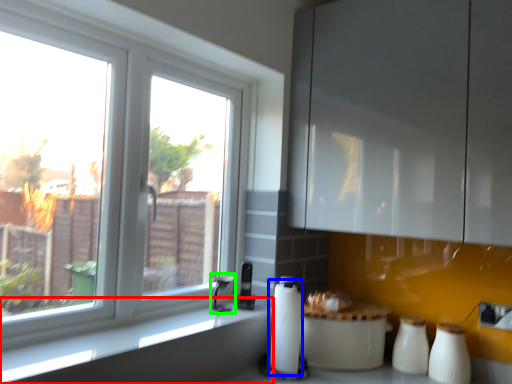
Question: Based on their relative distances, which object is farther from counter top (highlighted by a red box)? Choose from paper towel (highlighted by a blue box) and faucet (highlighted by a green box).

Choices:
 (A) paper towel
 (B) faucet

Answer: (B)